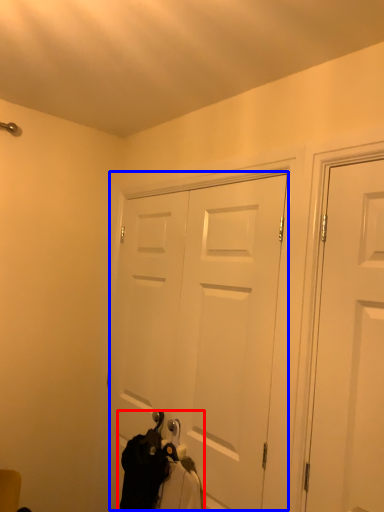
Question: Which object is further to the camera taking this photo, laundry (highlighted by a red box) or door (highlighted by a blue box)?

Choices:
 (A) laundry
 (B) door

Answer: (B)